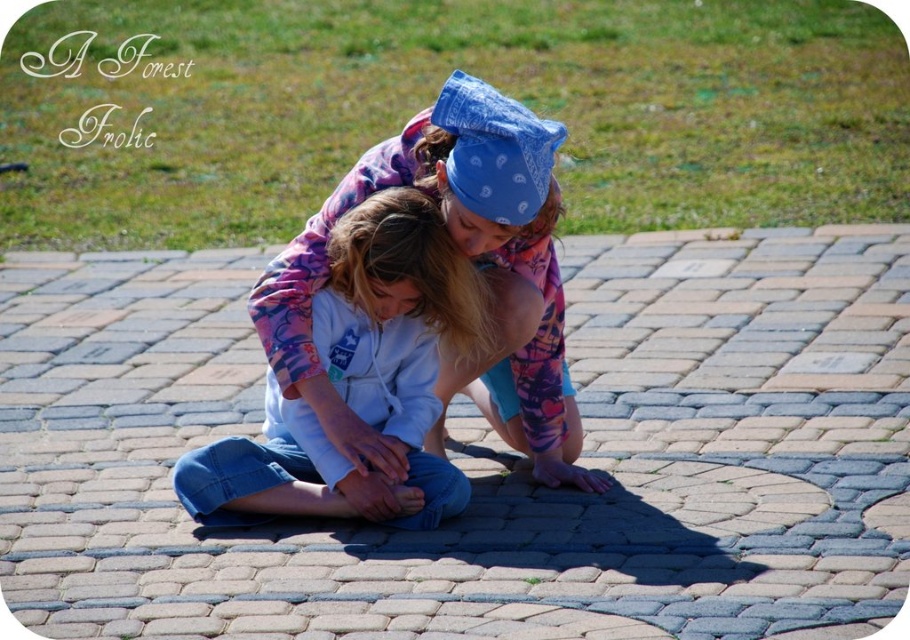
You are a photographer trying to capture a candid shot of the two people in the scene. You want to frame the shot so that the floral fleece jacket at center is on the left side of the photo and the blue denim jeans at center remains in the frame. Which direction should you move your camera to achieve this?

The floral fleece jacket at center is currently to the right of the blue denim jeans at center. To position the floral fleece jacket at center on the left side of the photo while keeping the blue denim jeans at center in frame, you should move your camera to the right.